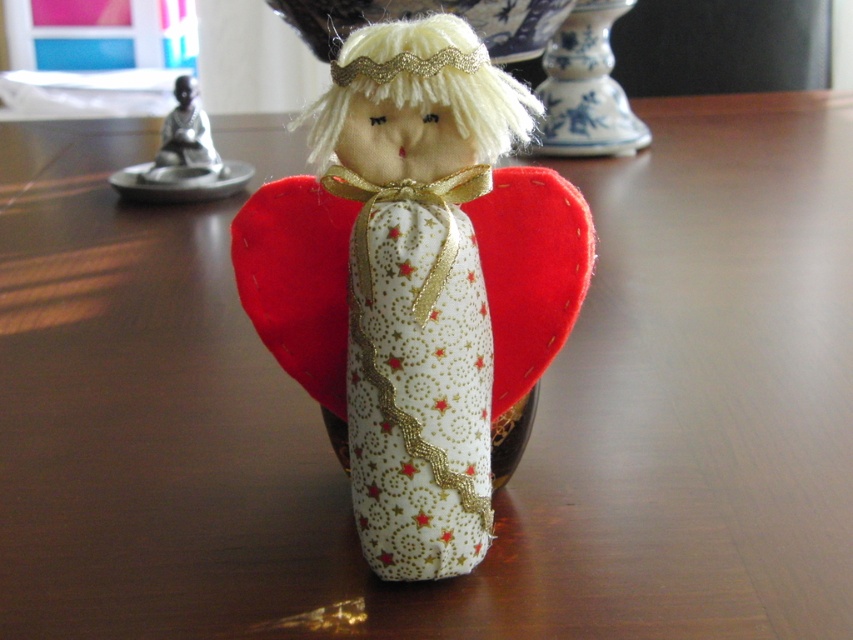
Question: Which point appears farthest from the camera in this image?

Choices:
 (A) (190, 100)
 (B) (320, 400)
 (C) (495, 202)

Answer: (A)

Question: Can you confirm if white fabric doll at center is smaller than red felt heart at center?

Choices:
 (A) yes
 (B) no

Answer: (B)

Question: Can you confirm if white fabric doll at center is wider than brushed metal statue at upper left?

Choices:
 (A) no
 (B) yes

Answer: (B)

Question: Which point is closer to the camera?

Choices:
 (A) (161, 124)
 (B) (461, 108)
 (C) (271, 227)

Answer: (B)

Question: Estimate the real-world distances between objects in this image. Which object is farther from the red felt heart at center?

Choices:
 (A) white fabric doll at center
 (B) brushed metal statue at upper left

Answer: (B)

Question: Can you confirm if white fabric doll at center is bigger than brushed metal statue at upper left?

Choices:
 (A) yes
 (B) no

Answer: (A)